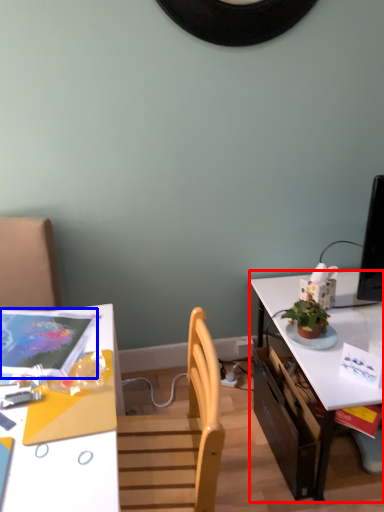
Question: Among these objects, which one is farthest to the camera, table (highlighted by a red box) or magazine (highlighted by a blue box)?

Choices:
 (A) table
 (B) magazine

Answer: (A)